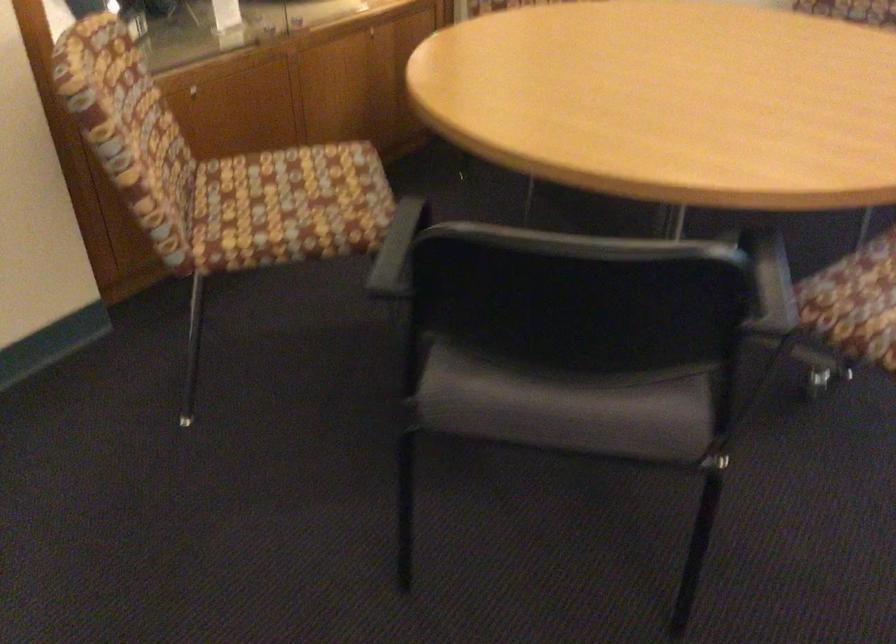
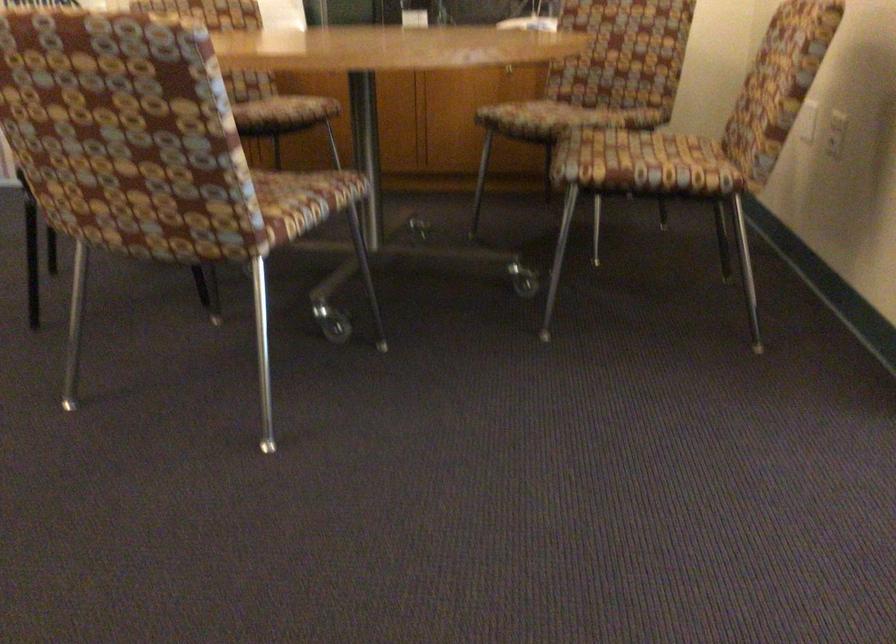
The point at (378, 192) is marked in the first image. Where is the corresponding point in the second image?

(279, 111)